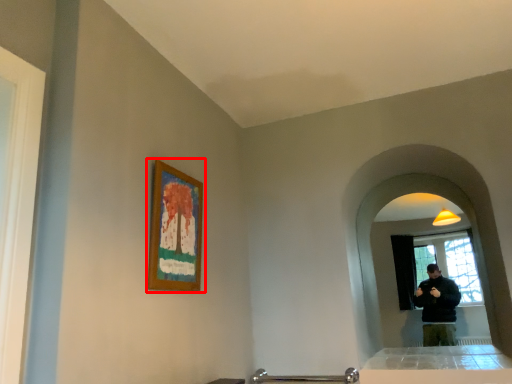
Question: In this image, where is picture frame (annotated by the red box) located relative to mirror?

Choices:
 (A) left
 (B) right

Answer: (A)